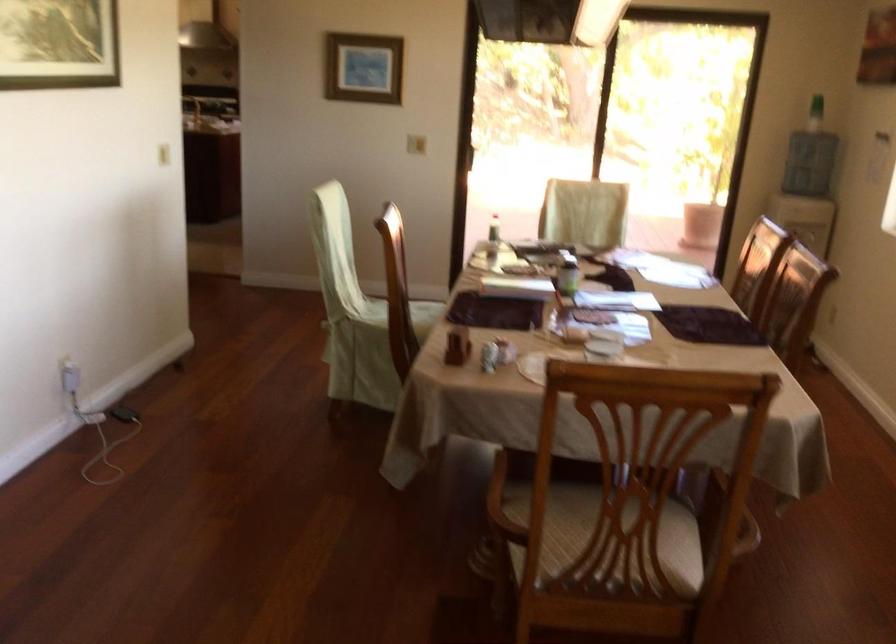
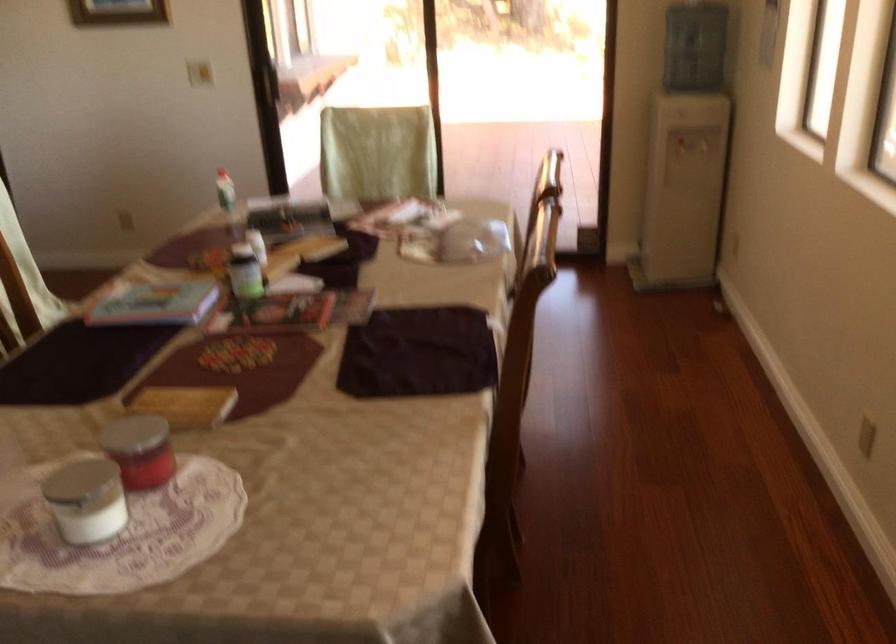
In the second image, find the point that corresponds to [613,346] in the first image.

(149, 458)